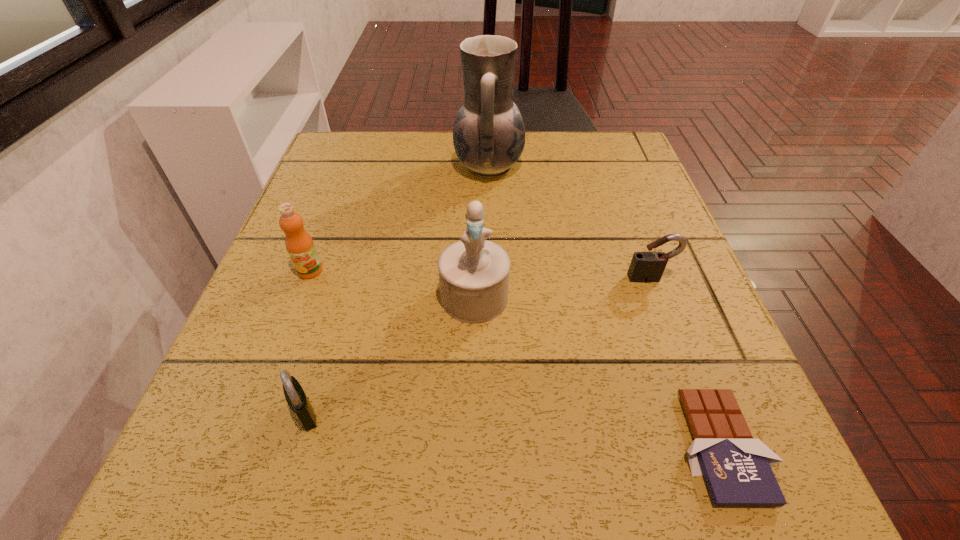
The image size is (960, 540). In order to click on padlock that is at the left edge in this screenshot , I will do `click(295, 396)`.

Locate an element on the screen. padlock positioned at the right edge is located at coordinates (646, 267).

Locate an element on the screen. Image resolution: width=960 pixels, height=540 pixels. chocolate bar positioned at the right edge is located at coordinates (737, 469).

The height and width of the screenshot is (540, 960). Find the location of `object located at the near right corner`. object located at the near right corner is located at coordinates (737, 469).

Locate an element on the screen. This screenshot has width=960, height=540. free space at the far edge of the desktop is located at coordinates pyautogui.click(x=422, y=156).

The image size is (960, 540). In order to click on free point at the left edge in this screenshot , I will do `click(344, 207)`.

What are the coordinates of `free region at the right edge` in the screenshot? It's located at (670, 231).

Locate an element on the screen. This screenshot has height=540, width=960. vacant space at the far left corner of the desktop is located at coordinates (x=384, y=170).

Identify the location of vacant area at the near left corner. Image resolution: width=960 pixels, height=540 pixels. (200, 508).

Image resolution: width=960 pixels, height=540 pixels. I want to click on vacant space at the far right corner of the desktop, so click(x=619, y=141).